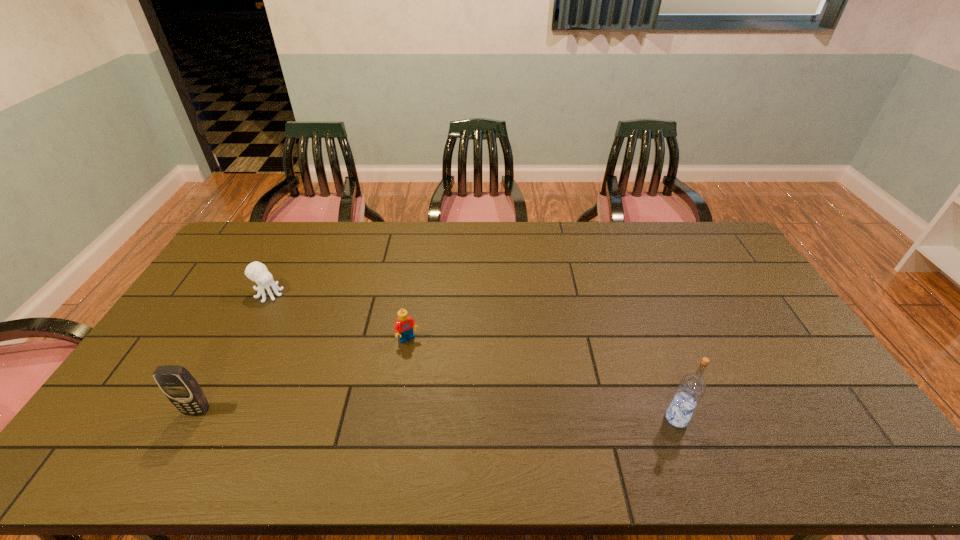
Identify the location of vacant space at the near left corner of the desktop. The height and width of the screenshot is (540, 960). (162, 398).

In the image, there is a desktop. Find the location of `vacant space at the far right corner`. vacant space at the far right corner is located at coordinates (710, 245).

This screenshot has height=540, width=960. I want to click on free point between the third nearest object and the octopus, so click(x=339, y=317).

Locate an element on the screen. The height and width of the screenshot is (540, 960). vacant space in between the octopus and the cellular telephone is located at coordinates (232, 352).

Locate an element on the screen. This screenshot has width=960, height=540. free space between the cellular telephone and the rightmost object is located at coordinates (437, 414).

I want to click on vacant point located between the second farthest object and the cellular telephone, so click(x=302, y=375).

What are the coordinates of `free space between the cellular telephone and the octopus` in the screenshot? It's located at (232, 352).

Find the location of a particular element. This screenshot has width=960, height=540. vacant area that lies between the rightmost object and the octopus is located at coordinates (472, 356).

What are the coordinates of `empty space between the rightmost object and the second farthest object` in the screenshot? It's located at 542,379.

Locate an element on the screen. The height and width of the screenshot is (540, 960). vacant area that lies between the octopus and the tallest object is located at coordinates (472, 356).